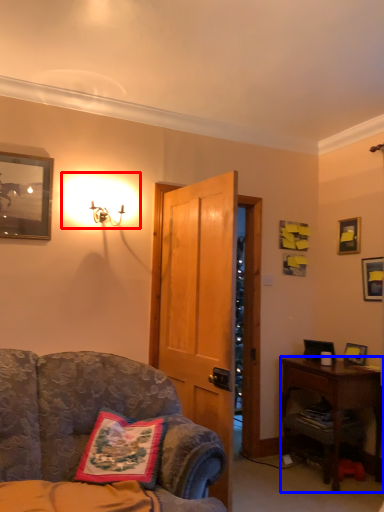
Question: Which point is further to the camera, lighting (highlighted by a red box) or desk (highlighted by a blue box)?

Choices:
 (A) lighting
 (B) desk

Answer: (B)